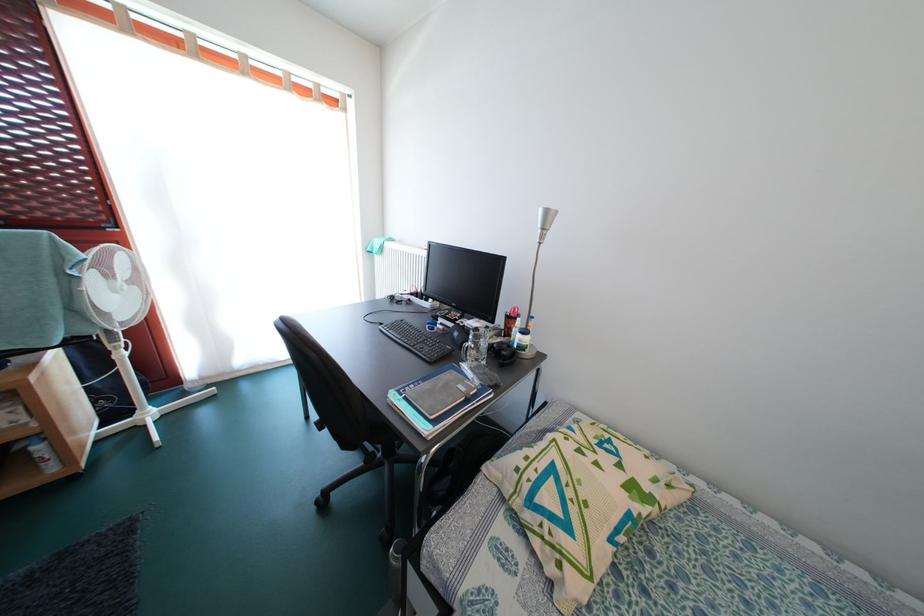
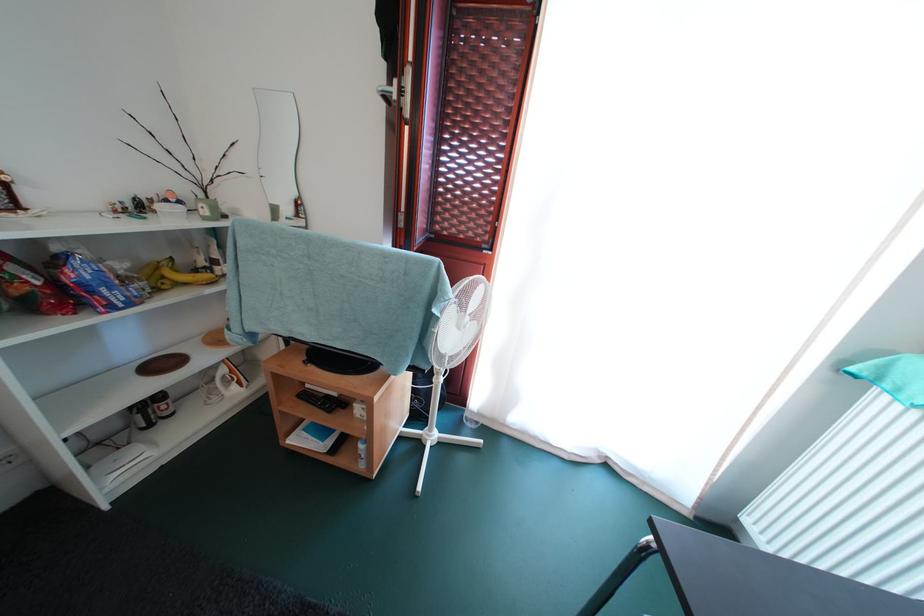
In the second image, find the point that corresponds to (x=35, y=459) in the first image.

(363, 453)